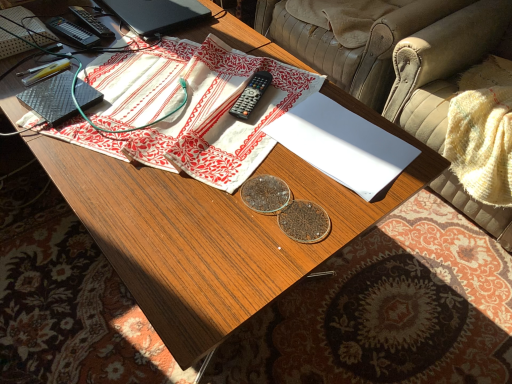
The image size is (512, 384). Identify the location of free spot behind white paper at center. (304, 84).